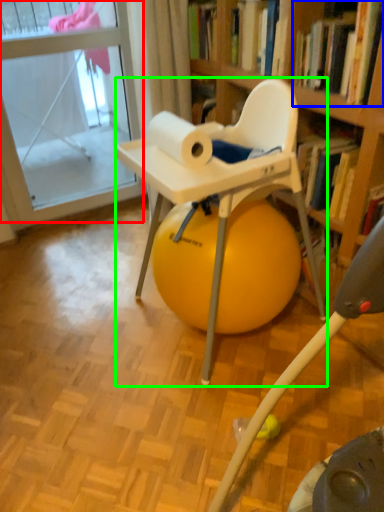
Question: Estimate the real-world distances between objects in this image. Which object is farther from glass door (highlighted by a red box), book (highlighted by a blue box) or chair (highlighted by a green box)?

Choices:
 (A) book
 (B) chair

Answer: (A)